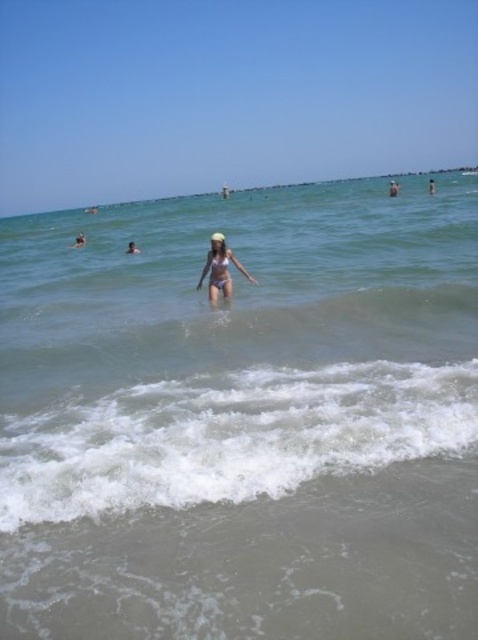
You are a lifeguard on duty and need to locate the white foamy wave at lower center in the image. What are its coordinates?

The white foamy wave at lower center is located at coordinates (229, 436).